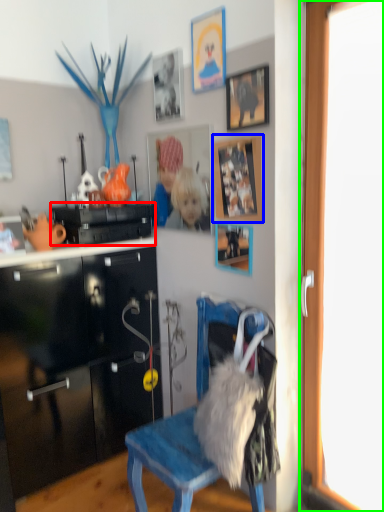
Question: Which object is the closest to the cabinetry (highlighted by a red box)? Choose among these: picture frame (highlighted by a blue box) or screen door (highlighted by a green box).

Choices:
 (A) picture frame
 (B) screen door

Answer: (A)